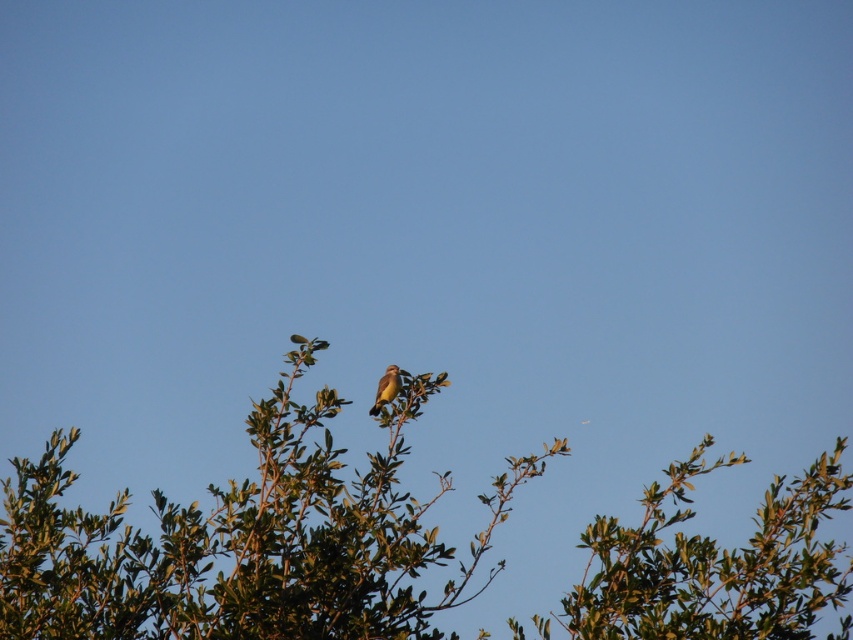
Question: Does green leafy tree at center have a larger size compared to yellowish-brown feathers at center?

Choices:
 (A) yes
 (B) no

Answer: (A)

Question: Can you confirm if green leafy tree at center is bigger than yellowish-brown feathers at center?

Choices:
 (A) no
 (B) yes

Answer: (B)

Question: Can you confirm if green leafy tree at center is smaller than yellowish-brown feathers at center?

Choices:
 (A) yes
 (B) no

Answer: (B)

Question: Which point is closer to the camera?

Choices:
 (A) green leafy tree at center
 (B) yellowish-brown feathers at center

Answer: (A)

Question: Which of the following is the farthest from the observer?

Choices:
 (A) (384, 563)
 (B) (392, 394)

Answer: (B)

Question: Which object is farther from the camera taking this photo?

Choices:
 (A) yellowish-brown feathers at center
 (B) green leafy tree at center

Answer: (A)